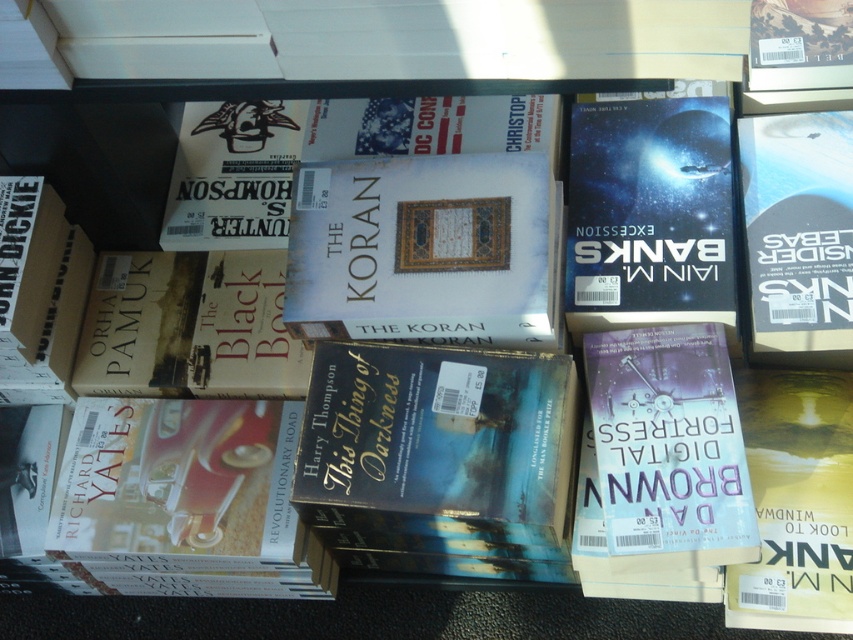
You are organizing a bookshelf and need to place the white matte book at center and the hardcover book at right. Given their sizes, which book should you place first to ensure stability?

The white matte book at center is larger than the hardcover book at right, so you should place the white matte book at center first to ensure stability, as larger books provide a more stable base.

You are a librarian who needs to place a new book on the shelf. The new book is 3.5 feet tall. Can the white matte book at center, which is currently occupying the spot, accommodate the new book in terms of height?

The white matte book at center is 3.29 feet from the camera, but the question refers to the height of the book itself, not its distance. Since the height of the book isn not provided in the Objects Description, it is impossible to determine if the new book will fit.

You are a librarian organizing books on a shelf. You have a white matte book at center and a hardcover book at right. The shelf you are placing them on has a space that is exactly 14 inches wide. Can both books fit side by side in this space without overlapping?

The white matte book at center and hardcover book at right are 14.05 inches apart from each other. Since the shelf space is only 14 inches wide, the combined width of the two books exceeds the available space by 0.05 inches. Therefore, they cannot fit side by side without overlapping.